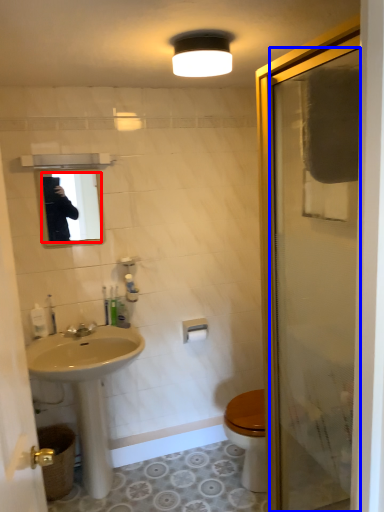
Question: Which object appears farthest to the camera in this image, mirror (highlighted by a red box) or door (highlighted by a blue box)?

Choices:
 (A) mirror
 (B) door

Answer: (A)